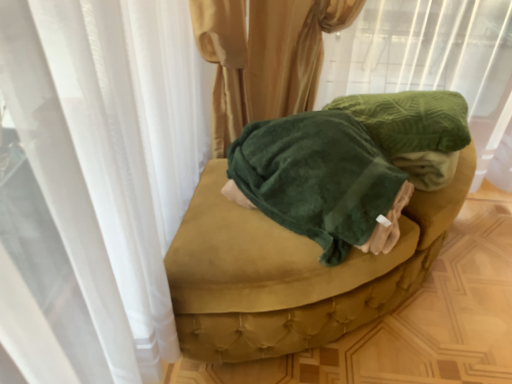
Question: Is green velvety fabric at upper center to the left of velvety green blanket at center from the viewer's perspective?

Choices:
 (A) yes
 (B) no

Answer: (B)

Question: Does green velvety fabric at upper center lie behind velvety green blanket at center?

Choices:
 (A) yes
 (B) no

Answer: (A)

Question: From a real-world perspective, is green velvety fabric at upper center positioned over velvety green blanket at center based on gravity?

Choices:
 (A) no
 (B) yes

Answer: (A)

Question: Is green velvety fabric at upper center outside velvety green blanket at center?

Choices:
 (A) yes
 (B) no

Answer: (A)

Question: Could velvety green blanket at center be considered to be inside green velvety fabric at upper center?

Choices:
 (A) yes
 (B) no

Answer: (B)

Question: Considering the positions of point (386, 269) and point (293, 122), is point (386, 269) closer or farther from the camera than point (293, 122)?

Choices:
 (A) farther
 (B) closer

Answer: (B)

Question: From the image's perspective, is velvet green ottoman at center located above or below velvety green blanket at center?

Choices:
 (A) above
 (B) below

Answer: (B)

Question: From their relative heights in the image, would you say velvet green ottoman at center is taller or shorter than velvety green blanket at center?

Choices:
 (A) short
 (B) tall

Answer: (A)

Question: In terms of size, does velvet green ottoman at center appear bigger or smaller than velvety green blanket at center?

Choices:
 (A) small
 (B) big

Answer: (B)

Question: From their relative heights in the image, would you say velvety green blanket at center is taller or shorter than green velvety fabric at upper center?

Choices:
 (A) short
 (B) tall

Answer: (A)

Question: Is point (340, 148) positioned closer to the camera than point (418, 31)?

Choices:
 (A) closer
 (B) farther

Answer: (A)

Question: From the image's perspective, is velvety green blanket at center above or below green velvety fabric at upper center?

Choices:
 (A) below
 (B) above

Answer: (A)

Question: In terms of width, does velvety green blanket at center look wider or thinner when compared to green velvety fabric at upper center?

Choices:
 (A) wide
 (B) thin

Answer: (B)

Question: Considering their positions, is green velvety fabric at upper center located in front of or behind velvety green blanket at center?

Choices:
 (A) behind
 (B) front

Answer: (A)

Question: Looking at the image, does green velvety fabric at upper center seem bigger or smaller compared to velvety green blanket at center?

Choices:
 (A) big
 (B) small

Answer: (A)